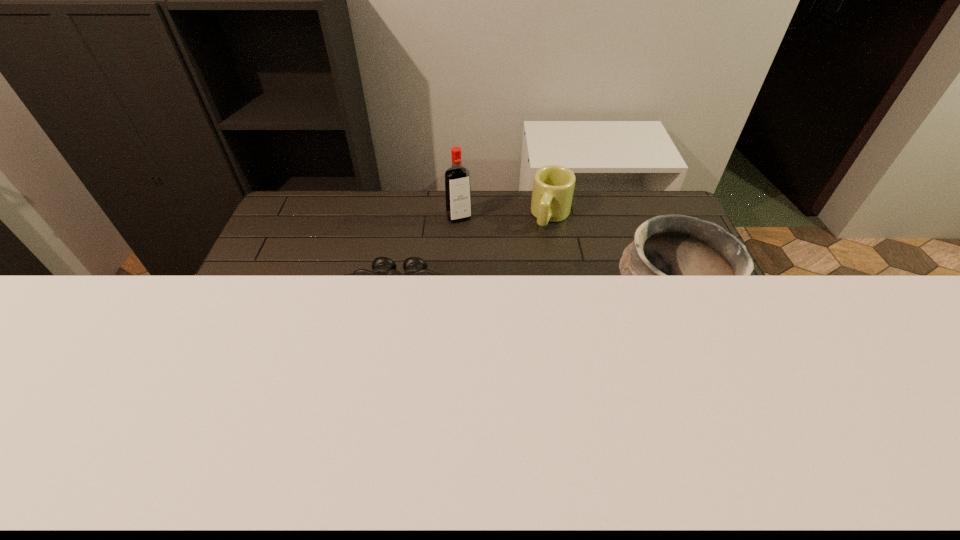
You are a GUI agent. You are given a task and a screenshot of the screen. Output one action in this format:
    pyautogui.click(x=<x>, y=<y>)
    Task: Click on the binoculars
    
    Given the screenshot: What is the action you would take?
    pyautogui.click(x=382, y=266)

At what (x,y) coordinates should I click in order to perform the action: click on the second tallest object. Please return your answer as a coordinate pair (x, y). The width and height of the screenshot is (960, 540). Looking at the image, I should click on (670, 245).

This screenshot has width=960, height=540. Find the location of `the rightmost object`. the rightmost object is located at coordinates (670, 245).

Identify the location of the second object from right to left. The width and height of the screenshot is (960, 540). tap(553, 186).

At what (x,y) coordinates should I click in order to perform the action: click on vodka. Please return your answer as a coordinate pair (x, y). This screenshot has width=960, height=540. Looking at the image, I should click on (457, 178).

Identify the location of vacant space located 0.120m at the eyepieces of the binoculars. The height and width of the screenshot is (540, 960). (386, 377).

Where is `vacant region located on the left of the third shortest object`? This screenshot has height=540, width=960. vacant region located on the left of the third shortest object is located at coordinates (579, 308).

Identify the location of vacant region located with the handle on the side of the mug. pyautogui.click(x=509, y=315).

You are a GUI agent. You are given a task and a screenshot of the screen. Output one action in this format:
    pyautogui.click(x=<x>, y=<y>)
    Task: Click on the free space located 0.070m with the handle on the side of the mug
    The height and width of the screenshot is (540, 960).
    Given the screenshot: What is the action you would take?
    tap(540, 244)

Identify the location of free space located 0.370m with the handle on the side of the mug. pyautogui.click(x=513, y=308).